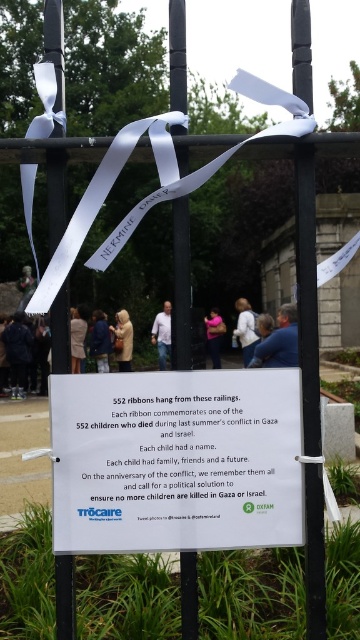
You are standing in front of the memorial and notice two points marked on the signboard. The first point is at coordinates point (24, 168) and the second is at point (249, 305). Which point is closer to you?

Point (24, 168) is closer to the viewer than point (249, 305).

You are standing at the base of the white matte pole at left and want to take a photo of the memorial setup. The camera you are using requires a minimum distance of 5 feet between the subject and the camera for a clear shot. Can you take a clear photo of the memorial setup with your current position?

The white matte pole at left and camera are 5.38 feet apart from each other. Since the required minimum distance is 5 feet, you can take a clear photo of the memorial setup from your current position as the distance is sufficient.

You are standing in front of the memorial setup and want to touch both the white matte ribbon at upper left and the white fabric at center. Which one can you reach without moving your position?

The white matte ribbon at upper left is closer to the viewer than the white fabric at center, so you can reach the white matte ribbon at upper left without moving your position.